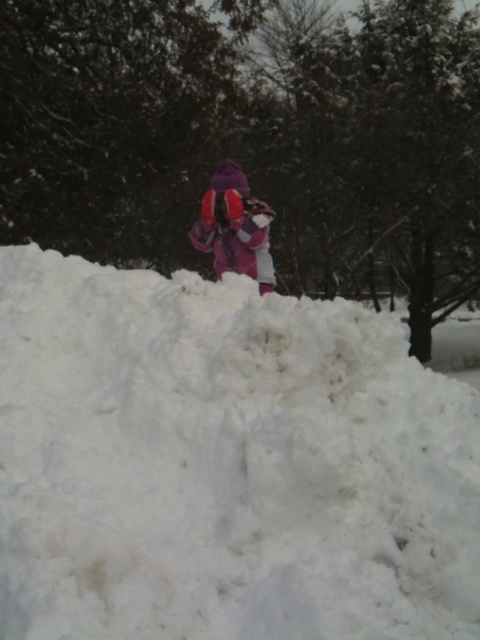
You are a drone operator trying to capture an aerial shot of the white fluffy snow at center. The camera is currently positioned at point A, which is at coordinates 0.6, 0.5. To get the best shot, you need to adjust the camera to the exact location of the snow. Should you move the camera to the left or right along the x axis? And should you move it up or down along the y axis?

The white fluffy snow at center is located at coordinates (x=224, y=464). The camera is at (x=240, y=384). To reach the snow, move the camera to the right along the x axis because 0.725 is greater than 0.6. Move the camera down along the y axis because 0.467 is less than 0.5.

You are a parent looking for your child in a snowy area. You see the white fluffy snow at center and the purple fleece jacket at center. Where would you look first to find your child?

The purple fleece jacket at center is above the white fluffy snow at center, so you should look above the white fluffy snow at center to find your child.

You are a parent looking for your child wearing a purple fleece jacket at center. You see the white fluffy snow at center in the scene. Where would you look relative to the snow to find the jacket?

The purple fleece jacket at center is to the left of the white fluffy snow at center, so you should look to the left side of the snow to find the jacket.